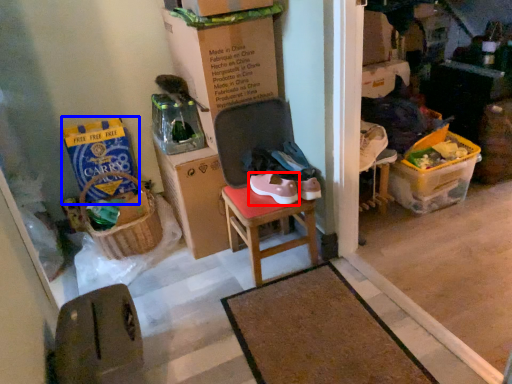
Question: Which of the following is the closest to the observer, footwear (highlighted by a red box) or box (highlighted by a blue box)?

Choices:
 (A) footwear
 (B) box

Answer: (A)